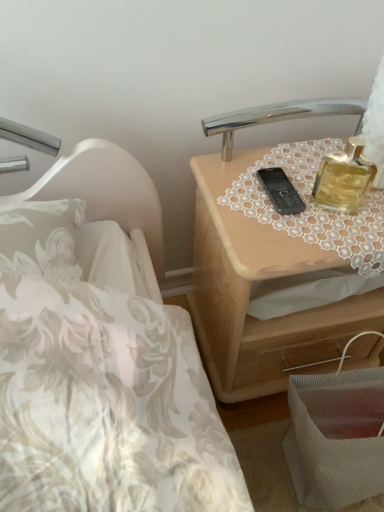
Question: From the image's perspective, is gold glass perfume at upper right under lace fabric at upper right?

Choices:
 (A) yes
 (B) no

Answer: (B)

Question: Is gold glass perfume at upper right not close to lace fabric at upper right?

Choices:
 (A) yes
 (B) no

Answer: (B)

Question: Does gold glass perfume at upper right have a larger size compared to lace fabric at upper right?

Choices:
 (A) yes
 (B) no

Answer: (B)

Question: From a real-world perspective, is gold glass perfume at upper right positioned under lace fabric at upper right based on gravity?

Choices:
 (A) yes
 (B) no

Answer: (B)

Question: Is gold glass perfume at upper right at the right side of lace fabric at upper right?

Choices:
 (A) yes
 (B) no

Answer: (B)

Question: Is point (241, 252) closer or farther from the camera than point (322, 181)?

Choices:
 (A) closer
 (B) farther

Answer: (A)

Question: Considering the positions of light wood nightstand at upper right and gold glass perfume at upper right in the image, is light wood nightstand at upper right bigger or smaller than gold glass perfume at upper right?

Choices:
 (A) big
 (B) small

Answer: (A)

Question: In the image, is light wood nightstand at upper right positioned in front of or behind gold glass perfume at upper right?

Choices:
 (A) front
 (B) behind

Answer: (B)

Question: Considering the positions of light wood nightstand at upper right and gold glass perfume at upper right in the image, is light wood nightstand at upper right taller or shorter than gold glass perfume at upper right?

Choices:
 (A) tall
 (B) short

Answer: (A)

Question: From the image's perspective, is lace fabric at upper right positioned above or below light wood nightstand at upper right?

Choices:
 (A) above
 (B) below

Answer: (A)

Question: Considering their positions, is lace fabric at upper right located in front of or behind light wood nightstand at upper right?

Choices:
 (A) front
 (B) behind

Answer: (A)

Question: Based on their positions, is lace fabric at upper right located to the left or right of light wood nightstand at upper right?

Choices:
 (A) left
 (B) right

Answer: (B)

Question: Looking at the image, does lace fabric at upper right seem bigger or smaller compared to light wood nightstand at upper right?

Choices:
 (A) big
 (B) small

Answer: (B)

Question: Is point (x=327, y=157) closer or farther from the camera than point (x=302, y=239)?

Choices:
 (A) closer
 (B) farther

Answer: (B)

Question: Is gold glass perfume at upper right spatially inside lace fabric at upper right, or outside of it?

Choices:
 (A) inside
 (B) outside

Answer: (B)